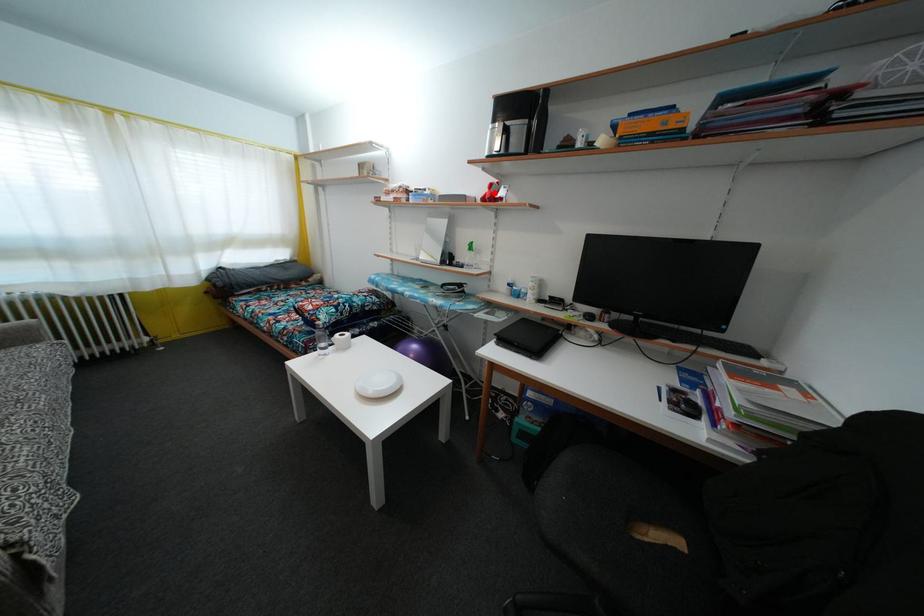
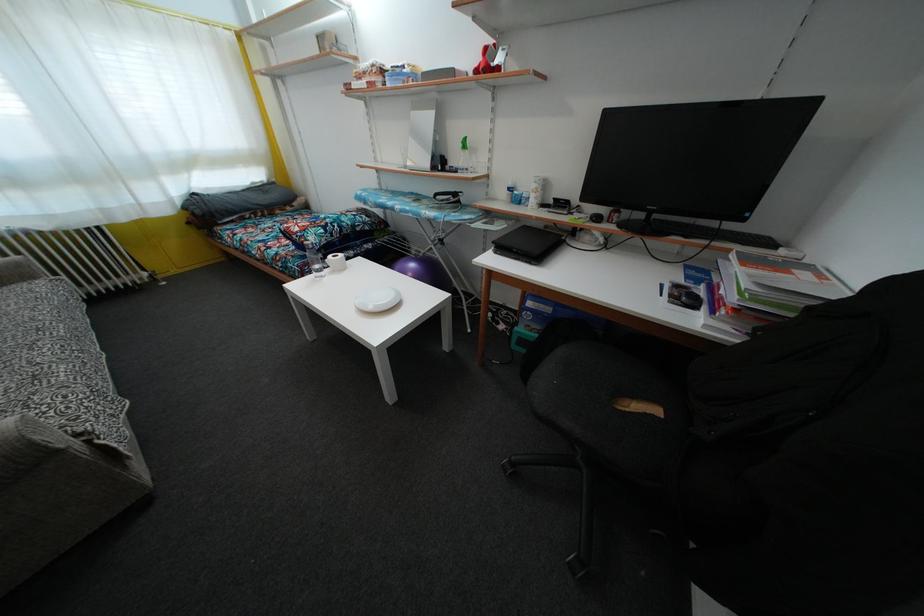
Where in the second image is the point corresponding to the highlighted location from the first image?

(490, 58)